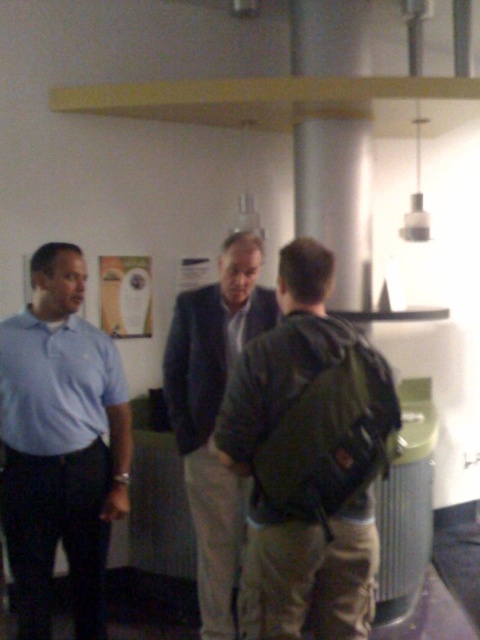
Question: Which point appears closest to the camera in this image?

Choices:
 (A) (16, 412)
 (B) (272, 387)
 (C) (245, 266)

Answer: (B)

Question: Can you confirm if green fabric backpack at center is thinner than light blue cotton shirt at left?

Choices:
 (A) no
 (B) yes

Answer: (A)

Question: Can you confirm if green fabric backpack at center is wider than light blue cotton shirt at left?

Choices:
 (A) yes
 (B) no

Answer: (A)

Question: Which point is farther to the camera?

Choices:
 (A) light blue cotton shirt at left
 (B) green fabric backpack at center

Answer: (A)

Question: Which object is farther from the camera taking this photo?

Choices:
 (A) dark blue suit at center
 (B) green fabric backpack at center
 (C) light blue cotton shirt at left

Answer: (A)

Question: Considering the relative positions of light blue cotton shirt at left and dark blue suit at center in the image provided, where is light blue cotton shirt at left located with respect to dark blue suit at center?

Choices:
 (A) above
 (B) below

Answer: (B)